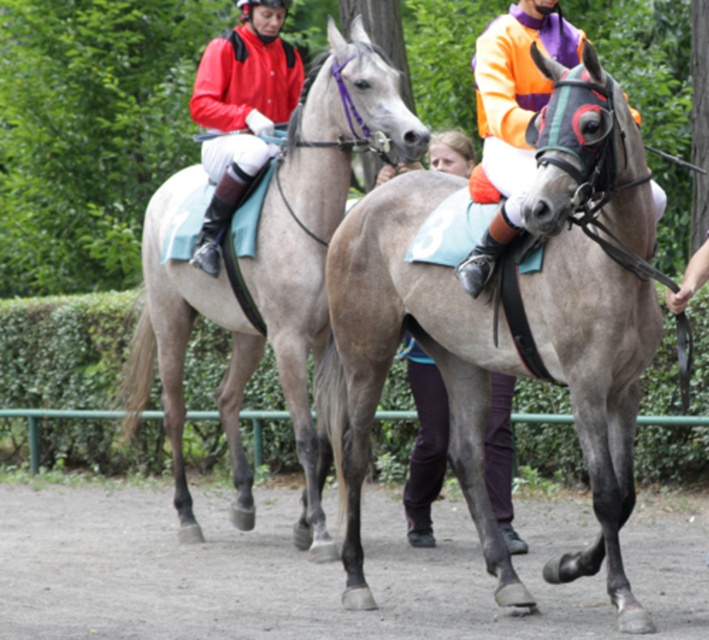
In the scene shown: You are a photographer trying to capture both the gray matte horse at center and the orange jersey at center in a single frame. Given that the horse is larger than the jersey, where should you position the camera relative to the horse to ensure both subjects are clearly visible in the photo?

Since the gray matte horse at center is larger in size than the orange jersey at center, you should position the camera closer to the orange jersey at center to balance their sizes in the frame, ensuring both are clearly visible.

You are a photographer positioned at the point marked by coordinates (x=318, y=232) in the image. You want to capture a photo of the gray matte horse at left. Is the horse within your current field of view?

The point at coordinates (x=318, y=232) indicates the gray matte horse at left, so yes, the horse is within your current field of view.